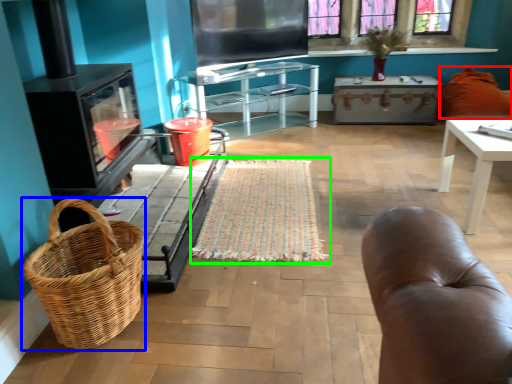
Question: Based on their relative distances, which object is nearer to pillow (highlighted by a red box)? Choose from picnic basket (highlighted by a blue box) and mat (highlighted by a green box).

Choices:
 (A) picnic basket
 (B) mat

Answer: (B)